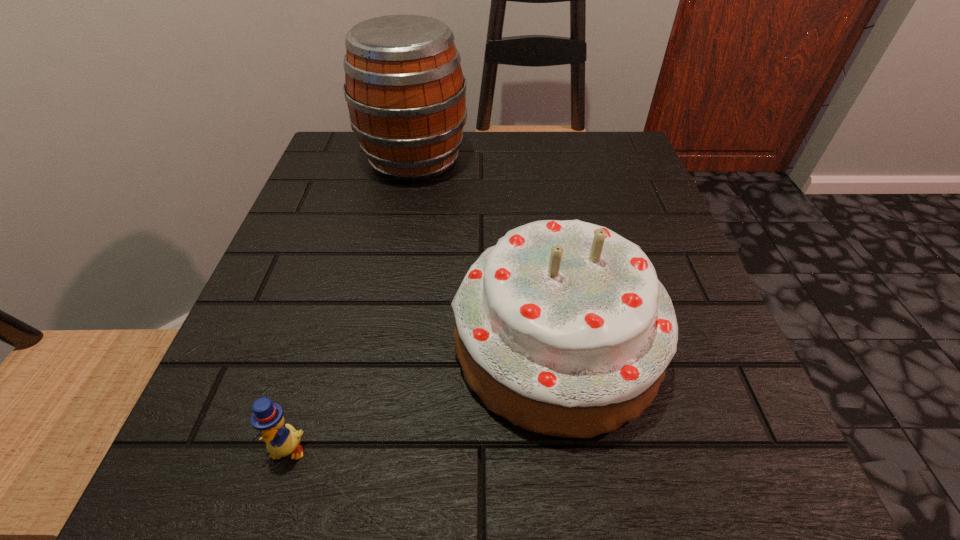
The width and height of the screenshot is (960, 540). I want to click on the tallest object, so click(x=406, y=94).

Locate an element on the screen. The height and width of the screenshot is (540, 960). cider is located at coordinates (406, 94).

The height and width of the screenshot is (540, 960). Identify the location of the second tallest object. (563, 328).

The width and height of the screenshot is (960, 540). Find the location of `the shortest object`. the shortest object is located at coordinates (281, 439).

Locate an element on the screen. vacant space located on the right of the tallest object is located at coordinates (588, 159).

This screenshot has height=540, width=960. Find the location of `free space located on the left of the second shortest object`. free space located on the left of the second shortest object is located at coordinates (412, 344).

Where is `object situated at the far edge`? Image resolution: width=960 pixels, height=540 pixels. object situated at the far edge is located at coordinates [x=406, y=94].

What are the coordinates of `cake present at the near edge` in the screenshot? It's located at (563, 328).

The height and width of the screenshot is (540, 960). Identify the location of duckling positioned at the near edge. (281, 439).

This screenshot has width=960, height=540. What are the coordinates of `cider positioned at the left edge` in the screenshot? It's located at (406, 94).